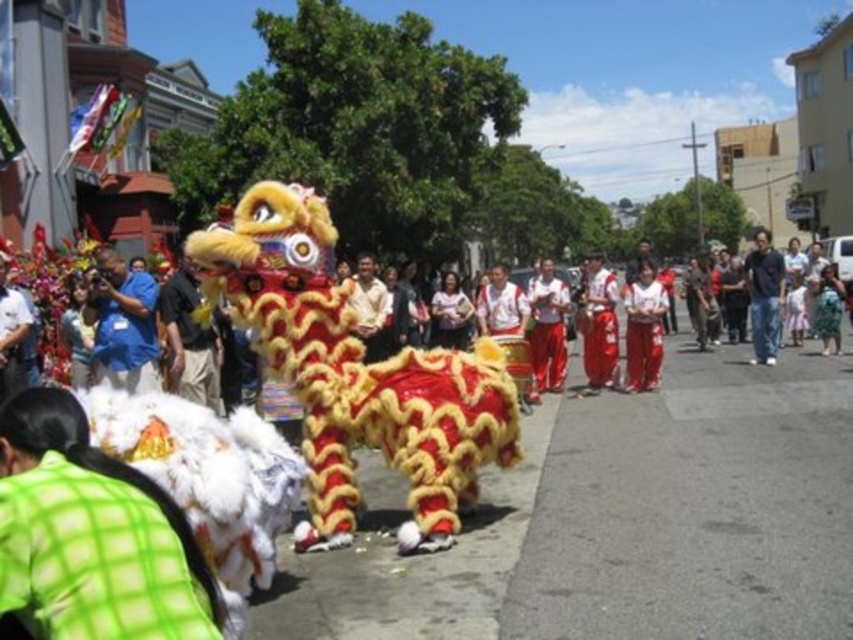
Which is more to the left, fuzzy red lion at center or matte red pants at center?

fuzzy red lion at center is more to the left.

Between point (351, 422) and point (627, 348), which one is positioned behind?

Point (627, 348)

Is point (401, 532) farther from viewer compared to point (647, 339)?

No, it is not.

Find the location of a particular element. The width and height of the screenshot is (853, 640). fuzzy red lion at center is located at coordinates (355, 372).

Who is shorter, blue cotton shirt at center or dark blue shirt at center?

Standing shorter between the two is blue cotton shirt at center.

Can you confirm if blue cotton shirt at center is thinner than dark blue shirt at center?

Indeed, blue cotton shirt at center has a lesser width compared to dark blue shirt at center.

Is point (151, 298) positioned behind point (776, 256)?

No.

You are a GUI agent. You are given a task and a screenshot of the screen. Output one action in this format:
    pyautogui.click(x=<x>, y=<y>)
    Task: Click on the blue cotton shirt at center
    The width and height of the screenshot is (853, 640).
    Given the screenshot: What is the action you would take?
    pyautogui.click(x=123, y=324)

Does matte black shirt at center have a lesser width compared to red satin pants at center?

Yes, matte black shirt at center is thinner than red satin pants at center.

Does point (198, 324) come closer to viewer compared to point (602, 339)?

Yes, point (198, 324) is closer to viewer.

Locate an element on the screen. matte black shirt at center is located at coordinates pos(190,339).